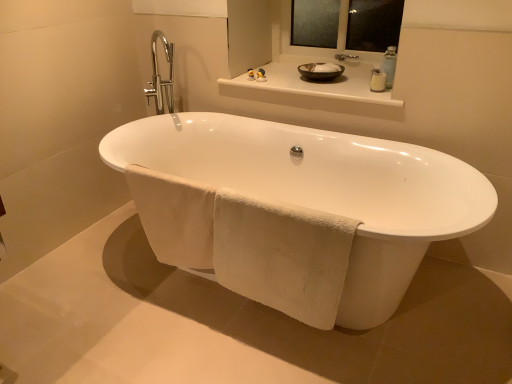
Image resolution: width=512 pixels, height=384 pixels. What do you see at coordinates (377, 79) in the screenshot? I see `clear plastic soap dispenser at upper right` at bounding box center [377, 79].

Image resolution: width=512 pixels, height=384 pixels. What are the coordinates of `white cotton towel at lower center, the 1th bath towel when ordered from right to left` in the screenshot? It's located at (282, 256).

Identify the location of white soft towel at lower center, the 1th bath towel from the left. The width and height of the screenshot is (512, 384). (174, 217).

At what (x,y) coordinates should I click in order to perform the action: click on clear plastic soap dispenser at upper right. Please return your answer as a coordinate pair (x, y). Looking at the image, I should click on (377, 79).

In the scene shown: Is white glossy counter top at upper center positioned before matte brown bowl at upper center?

That is True.

Considering the sizes of white glossy counter top at upper center and matte brown bowl at upper center in the image, is white glossy counter top at upper center taller or shorter than matte brown bowl at upper center?

Clearly, white glossy counter top at upper center is shorter compared to matte brown bowl at upper center.

Is white glossy counter top at upper center aimed at matte brown bowl at upper center?

No, white glossy counter top at upper center is not aimed at matte brown bowl at upper center.

From the image's perspective, does white glossy counter top at upper center appear lower than matte brown bowl at upper center?

Yes.

Is white soft towel at lower center, the 1th bath towel from the left, touching matte rubber duck at upper center?

No, white soft towel at lower center, the 1th bath towel from the left, is not beside matte rubber duck at upper center.

Find the location of a particular element. bath towel on the left side of matte rubber duck at upper center is located at coordinates (174, 217).

Is white soft towel at lower center, the 1th bath towel from the left, to the left of matte rubber duck at upper center from the viewer's perspective?

Indeed, white soft towel at lower center, the 1th bath towel from the left, is positioned on the left side of matte rubber duck at upper center.

Considering their positions, is white soft towel at lower center, which appears as the second bath towel when viewed from the right, located in front of or behind matte rubber duck at upper center?

In the image, white soft towel at lower center, which appears as the second bath towel when viewed from the right, appears in front of matte rubber duck at upper center.

How different are the orientations of matte brown bowl at upper center and white cotton towel at lower center, the 1th bath towel when ordered from right to left, in degrees?

2.22 degrees.

From a real-world perspective, is matte brown bowl at upper center physically located above or below white cotton towel at lower center, the 1th bath towel when ordered from right to left?

matte brown bowl at upper center is situated higher than white cotton towel at lower center, the 1th bath towel when ordered from right to left, in the real world.

Is matte brown bowl at upper center positioned with its back to white cotton towel at lower center, the 1th bath towel when ordered from right to left?

matte brown bowl at upper center does not have its back to white cotton towel at lower center, the 1th bath towel when ordered from right to left.

Can you confirm if matte brown bowl at upper center is wider than white cotton towel at lower center, positioned as the 2th bath towel in left-to-right order?

Yes.

From the image's perspective, which is below, transparent glass mirror at upper center or white ceramic bathtub at center?

white ceramic bathtub at center is shown below in the image.

Is transparent glass mirror at upper center aimed at white ceramic bathtub at center?

No, transparent glass mirror at upper center is not aimed at white ceramic bathtub at center.

In the scene shown: Is transparent glass mirror at upper center completely or partially outside of white ceramic bathtub at center?

That's correct, transparent glass mirror at upper center is outside of white ceramic bathtub at center.

Image resolution: width=512 pixels, height=384 pixels. Find the location of `basin behind the white cotton towel at lower center, positioned as the 2th bath towel in left-to-right order`. basin behind the white cotton towel at lower center, positioned as the 2th bath towel in left-to-right order is located at coordinates (320, 71).

Is matte brown bowl at upper center completely or partially inside white cotton towel at lower center, the 1th bath towel when ordered from right to left?

No, matte brown bowl at upper center is not inside white cotton towel at lower center, the 1th bath towel when ordered from right to left.

Is white cotton towel at lower center, positioned as the 2th bath towel in left-to-right order, turned away from matte brown bowl at upper center?

Yes, white cotton towel at lower center, positioned as the 2th bath towel in left-to-right order,'s orientation is away from matte brown bowl at upper center.

How different are the orientations of white cotton towel at lower center, positioned as the 2th bath towel in left-to-right order, and matte brown bowl at upper center in degrees?

There is a 2.22-degree angle between the facing directions of white cotton towel at lower center, positioned as the 2th bath towel in left-to-right order, and matte brown bowl at upper center.

Is clear plastic soap dispenser at upper right at the back of transparent glass mirror at upper center?

No, transparent glass mirror at upper center is not facing away from clear plastic soap dispenser at upper right.

From a real-world perspective, is transparent glass mirror at upper center on top of clear plastic soap dispenser at upper right?

Yes, from a real-world perspective, transparent glass mirror at upper center is above clear plastic soap dispenser at upper right.

Considering the relative sizes of transparent glass mirror at upper center and clear plastic soap dispenser at upper right in the image provided, is transparent glass mirror at upper center shorter than clear plastic soap dispenser at upper right?

In fact, transparent glass mirror at upper center may be taller than clear plastic soap dispenser at upper right.

Considering the positions of point (355, 73) and point (373, 77), is point (355, 73) closer or farther from the camera than point (373, 77)?

Point (355, 73) is positioned farther from the camera compared to point (373, 77).

Considering the positions of objects white glossy counter top at upper center and clear plastic soap dispenser at upper right in the image provided, who is behind, white glossy counter top at upper center or clear plastic soap dispenser at upper right?

clear plastic soap dispenser at upper right is more distant.

Does white glossy counter top at upper center have a greater height compared to clear plastic soap dispenser at upper right?

Result: No.

Where is `basin above the white glossy counter top at upper center (from a real-world perspective)`? The width and height of the screenshot is (512, 384). basin above the white glossy counter top at upper center (from a real-world perspective) is located at coordinates (320, 71).

Find the location of a particular element. toiletry behind the white soft towel at lower center, which appears as the second bath towel when viewed from the right is located at coordinates (251, 75).

Estimate the real-world distances between objects in this image. Which object is further from white soft towel at lower center, which appears as the second bath towel when viewed from the right, matte rubber duck at upper center or white ceramic bathtub at center?

Among the two, matte rubber duck at upper center is located further to white soft towel at lower center, which appears as the second bath towel when viewed from the right.

From the image, which object appears to be nearer to white soft towel at lower center, which appears as the second bath towel when viewed from the right, clear plastic soap dispenser at upper right or transparent glass mirror at upper center?

clear plastic soap dispenser at upper right is closer to white soft towel at lower center, which appears as the second bath towel when viewed from the right.

Looking at the image, which one is located closer to white ceramic bathtub at center, white glossy counter top at upper center or transparent glass mirror at upper center?

white glossy counter top at upper center is positioned closer to the anchor white ceramic bathtub at center.

From the picture: Looking at the image, which one is located closer to white soft towel at lower center, which appears as the second bath towel when viewed from the right, transparent glass mirror at upper center or clear plastic soap dispenser at upper right?

clear plastic soap dispenser at upper right lies closer to white soft towel at lower center, which appears as the second bath towel when viewed from the right, than the other object.

Considering their positions, is matte rubber duck at upper center positioned further to transparent glass mirror at upper center than clear plastic soap dispenser at upper right?

The object further to transparent glass mirror at upper center is matte rubber duck at upper center.

Based on their spatial positions, is white ceramic bathtub at center or clear plastic soap dispenser at upper right closer to matte brown bowl at upper center?

Among the two, clear plastic soap dispenser at upper right is located nearer to matte brown bowl at upper center.

Estimate the real-world distances between objects in this image. Which object is further from white ceramic bathtub at center, white soft towel at lower center, the 1th bath towel from the left, or white glossy counter top at upper center?

white glossy counter top at upper center.

Based on their spatial positions, is white ceramic bathtub at center or white glossy counter top at upper center closer to transparent glass mirror at upper center?

Based on the image, white glossy counter top at upper center appears to be nearer to transparent glass mirror at upper center.

At what (x,y) coordinates should I click in order to perform the action: click on bath towel between white soft towel at lower center, the 1th bath towel from the left, and white ceramic bathtub at center. Please return your answer as a coordinate pair (x, y). Image resolution: width=512 pixels, height=384 pixels. Looking at the image, I should click on (282, 256).

This screenshot has height=384, width=512. In order to click on counter top between transparent glass mirror at upper center and white cotton towel at lower center, positioned as the 2th bath towel in left-to-right order, in the up-down direction in this screenshot , I will do `click(317, 85)`.

This screenshot has width=512, height=384. Find the location of `bathtub between transparent glass mirror at upper center and white soft towel at lower center, the 1th bath towel from the left, in the up-down direction`. bathtub between transparent glass mirror at upper center and white soft towel at lower center, the 1th bath towel from the left, in the up-down direction is located at coordinates (298, 197).

Identify the location of counter top between white ceramic bathtub at center and transparent glass mirror at upper center from front to back. The height and width of the screenshot is (384, 512). (317, 85).